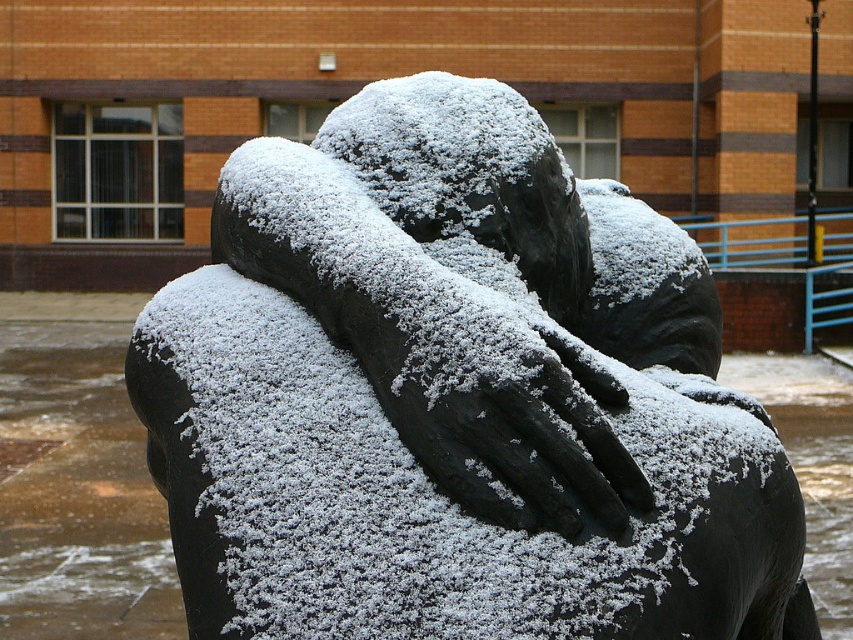
You are a photographer standing at the entrance of the building. You want to take a photo of the black matte statue at center. Which direction should you face to ensure the statue is in the center of your frame?

You should face the direction where the black matte statue at center is located, which is at point coordinates of 0.622 on the x axis and 0.536 on the y axis, so you need to adjust your camera to center the statue by aligning it to those coordinates.

You are an art student analyzing the sculpture in the image. You observe the black matte statue at center and the slick black hand at center. Which object is taller?

The black matte statue at center is taller than the slick black hand at center.